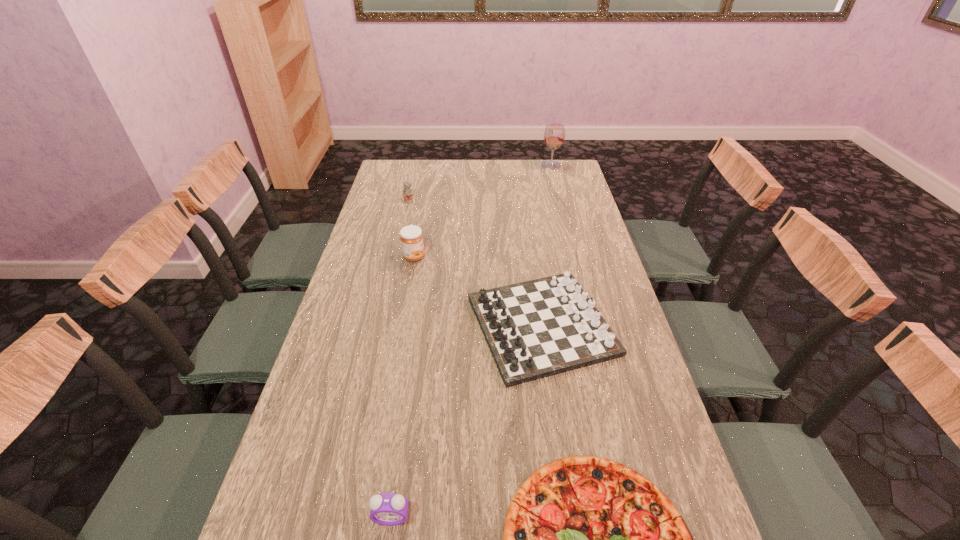
Find the location of a particular element. Image resolution: width=960 pixels, height=540 pixels. vacant space that's between the alarm clock and the fourth farthest object is located at coordinates (467, 421).

Where is `vacant space in between the teddy bear and the chessboard`? vacant space in between the teddy bear and the chessboard is located at coordinates (475, 262).

Locate an element on the screen. This screenshot has width=960, height=540. empty space that is in between the alarm clock and the jam is located at coordinates (403, 387).

The height and width of the screenshot is (540, 960). In order to click on vacant area between the chessboard and the second tallest object in this screenshot , I will do `click(478, 291)`.

Select which object is the second closest to the tallest object. Please provide its 2D coordinates. Your answer should be formatted as a tuple, i.e. [(x, y)], where the tuple contains the x and y coordinates of a point satisfying the conditions above.

[(539, 328)]

Find the location of a particular element. the third closest object to the third nearest object is located at coordinates (389, 509).